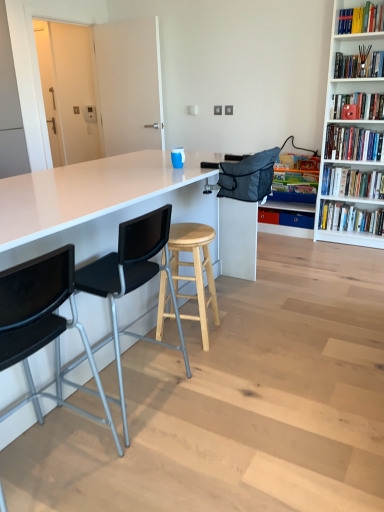
Locate an element on the screen. The image size is (384, 512). vacant area that lies between black plastic chair at left, marked as the first chair in a back-to-front arrangement, and black plastic chair at left, arranged as the second chair when viewed from the back is located at coordinates (94, 428).